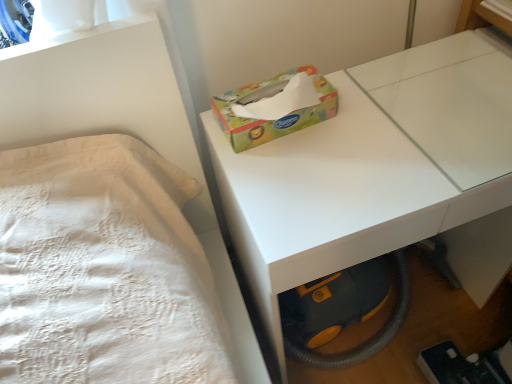
At what (x,y) coordinates should I click in order to perform the action: click on free space above white glossy table at center (from a real-world perspective). Please return your answer as a coordinate pair (x, y). Image resolution: width=512 pixels, height=384 pixels. Looking at the image, I should click on (372, 129).